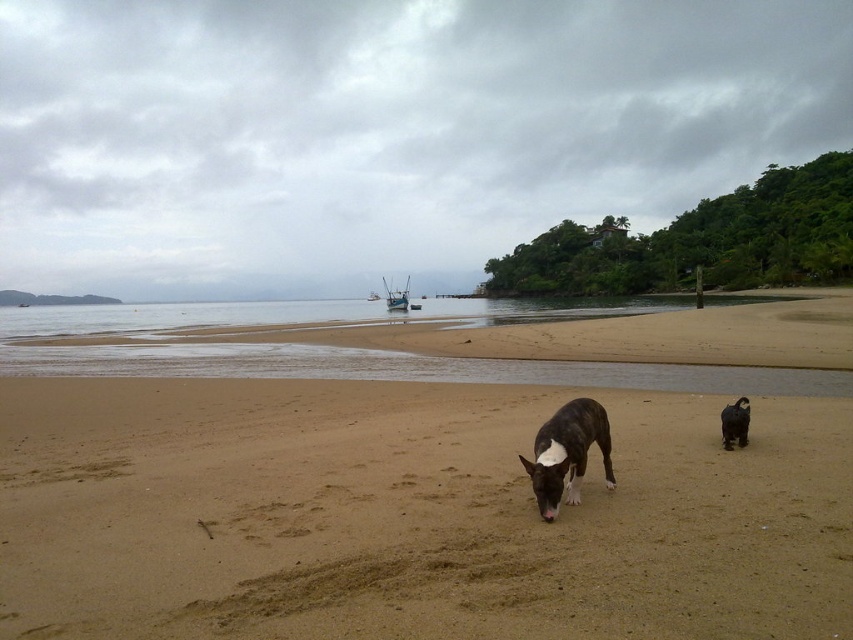
The height and width of the screenshot is (640, 853). Describe the element at coordinates (567, 452) in the screenshot. I see `white glossy dog at center` at that location.

Can you confirm if white glossy dog at center is taller than brown fur dog at center?

Yes, white glossy dog at center is taller than brown fur dog at center.

Does point (572, 410) come behind point (735, 426)?

No, (572, 410) is closer to viewer.

Find the location of a particular element. This screenshot has width=853, height=640. white glossy dog at center is located at coordinates (567, 452).

Does white glossy dog at center have a lesser width compared to blue wooden boat at center?

Yes.

How much distance is there between white glossy dog at center and blue wooden boat at center?

64.97 meters

Which is in front, point (601, 422) or point (405, 301)?

Point (601, 422) is in front.

Locate an element on the screen. Image resolution: width=853 pixels, height=640 pixels. white glossy dog at center is located at coordinates (567, 452).

Is brown sandy beach at center positioned behind brown fur dog at center?

No, brown sandy beach at center is in front of brown fur dog at center.

Is brown sandy beach at center positioned in front of brown fur dog at center?

Yes, it is in front of brown fur dog at center.

Between point (491, 538) and point (729, 420), which one is positioned behind?

The point (729, 420) is more distant.

Identify the location of brown sandy beach at center. Image resolution: width=853 pixels, height=640 pixels. (409, 515).